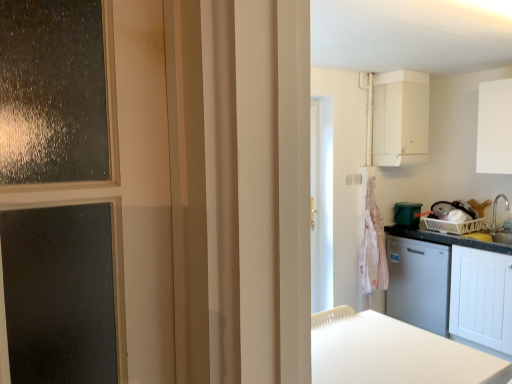
Question: Is white matte cabinet at right, which is the 3th cabinetry in top-to-bottom order, spatially inside white matte table at lower center, or outside of it?

Choices:
 (A) outside
 (B) inside

Answer: (A)

Question: Is white matte cabinet at right, which is the 3th cabinetry in top-to-bottom order, bigger or smaller than white matte table at lower center?

Choices:
 (A) small
 (B) big

Answer: (B)

Question: Estimate the real-world distances between objects in this image. Which object is farther from the white matte cabinet at upper right, acting as the 3th cabinetry starting from the bottom?

Choices:
 (A) pink striped fabric at right
 (B) white matte cabinet at lower right, positioned as the 2th cabinetry in bottom-to-top order
 (C) green plastic bucket at right
 (D) satin silver faucet at right
 (E) white matte table at lower center

Answer: (E)

Question: Which object is positioned closest to the pink striped fabric at right?

Choices:
 (A) white matte cabinet at lower right, positioned as the 2th cabinetry in bottom-to-top order
 (B) satin silver faucet at right
 (C) white matte cabinet at right, which is the 3th cabinetry in top-to-bottom order
 (D) white matte cabinet at upper right, acting as the 3th cabinetry starting from the bottom
 (E) white matte table at lower center

Answer: (A)